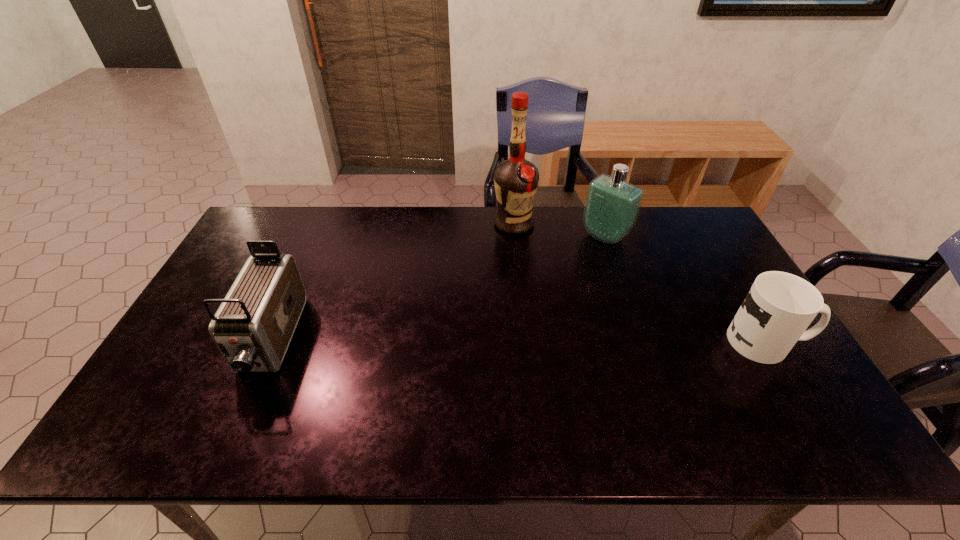
Locate an element on the screen. This screenshot has height=540, width=960. camcorder is located at coordinates (253, 327).

Locate an element on the screen. The image size is (960, 540). the shortest object is located at coordinates (779, 307).

I want to click on the rightmost object, so click(779, 307).

Where is `perfume`? This screenshot has height=540, width=960. perfume is located at coordinates (612, 205).

In order to click on liquor in this screenshot , I will do `click(516, 180)`.

The height and width of the screenshot is (540, 960). I want to click on the tallest object, so click(x=516, y=180).

Where is `free spot located 0.140m on the front label of the perfume`? This screenshot has width=960, height=540. free spot located 0.140m on the front label of the perfume is located at coordinates (568, 267).

You are a GUI agent. You are given a task and a screenshot of the screen. Output one action in this format:
    pyautogui.click(x=<x>, y=<y>)
    Task: Click on the free region located on the front label of the perfume
    The image size is (960, 540).
    Given the screenshot: What is the action you would take?
    pyautogui.click(x=561, y=274)

Where is `vacant region located 0.230m on the front label of the perfume`? Image resolution: width=960 pixels, height=540 pixels. vacant region located 0.230m on the front label of the perfume is located at coordinates (551, 282).

This screenshot has height=540, width=960. Identify the location of vacant position located 0.160m on the front and back of the third object from right to left. (529, 267).